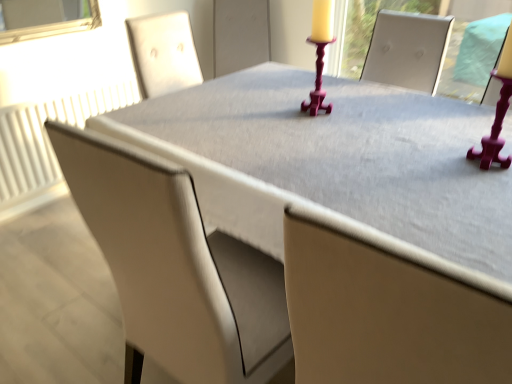
Question: Should I look upward or downward to see white textured radiator at left?

Choices:
 (A) down
 (B) up

Answer: (B)

Question: From a real-world perspective, does white textured radiator at left stand above matte gray table at center?

Choices:
 (A) no
 (B) yes

Answer: (A)

Question: Does white textured radiator at left have a larger size compared to matte gray table at center?

Choices:
 (A) no
 (B) yes

Answer: (A)

Question: Is white textured radiator at left taller than matte gray table at center?

Choices:
 (A) no
 (B) yes

Answer: (A)

Question: Is white textured radiator at left in contact with matte gray table at center?

Choices:
 (A) no
 (B) yes

Answer: (A)

Question: Is white textured radiator at left oriented towards matte gray table at center?

Choices:
 (A) no
 (B) yes

Answer: (B)

Question: From the image's perspective, is white textured radiator at left below matte gray table at center?

Choices:
 (A) yes
 (B) no

Answer: (B)

Question: Does matte gray table at center lie in front of white textured radiator at left?

Choices:
 (A) no
 (B) yes

Answer: (B)

Question: Is the position of matte gray table at center more distant than that of white textured radiator at left?

Choices:
 (A) yes
 (B) no

Answer: (B)

Question: Is white textured radiator at left completely or partially inside matte gray table at center?

Choices:
 (A) yes
 (B) no

Answer: (B)

Question: From a real-world perspective, is matte gray table at center positioned over white textured radiator at left based on gravity?

Choices:
 (A) yes
 (B) no

Answer: (A)

Question: Can you confirm if matte gray table at center is shorter than white textured radiator at left?

Choices:
 (A) no
 (B) yes

Answer: (A)

Question: Is matte gray table at center aimed at white textured radiator at left?

Choices:
 (A) yes
 (B) no

Answer: (B)

Question: Is matte beige chair at center next to matte gray table at center?

Choices:
 (A) no
 (B) yes

Answer: (A)